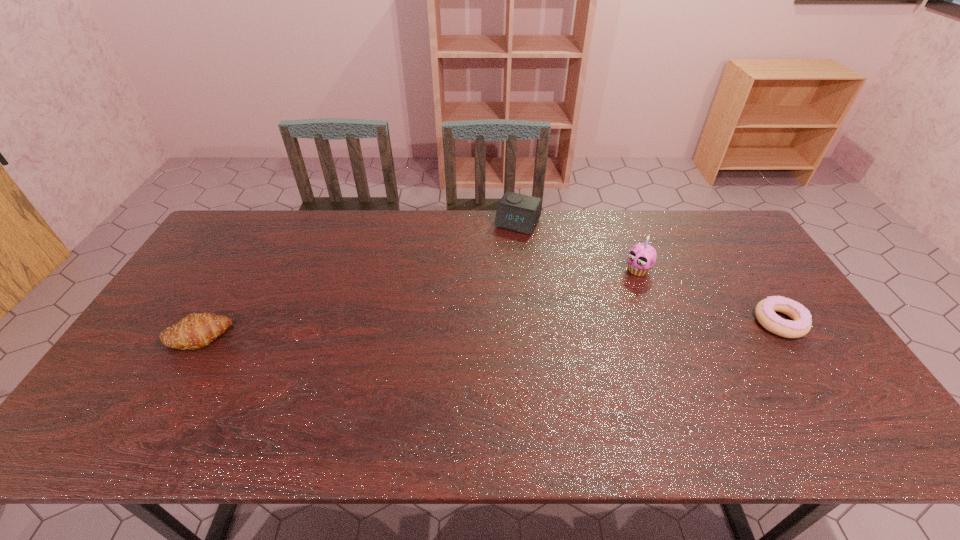
This screenshot has width=960, height=540. In order to click on the second shortest object in this screenshot , I will do `click(195, 331)`.

Find the location of a particular element. the leftmost object is located at coordinates (195, 331).

This screenshot has width=960, height=540. What are the coordinates of `doughnut` in the screenshot? It's located at (800, 326).

Identify the location of the shortest object. This screenshot has height=540, width=960. (800, 326).

At what (x,y) coordinates should I click in order to perform the action: click on the second farthest object. Please return your answer as a coordinate pair (x, y). The image size is (960, 540). Looking at the image, I should click on (641, 257).

This screenshot has height=540, width=960. What are the coordinates of `the tallest object` in the screenshot? It's located at (641, 257).

The height and width of the screenshot is (540, 960). I want to click on the farthest object, so click(516, 212).

Locate an element on the screen. alarm clock is located at coordinates (516, 212).

You are a GUI agent. You are given a task and a screenshot of the screen. Output one action in this format:
    pyautogui.click(x=<x>, y=<y>)
    Task: Click on the free region located 0.140m on the front of the leftmost object
    
    Given the screenshot: What is the action you would take?
    pyautogui.click(x=157, y=400)

Image resolution: width=960 pixels, height=540 pixels. I want to click on vacant space situated 0.140m on the front of the doughnut, so click(x=822, y=386).